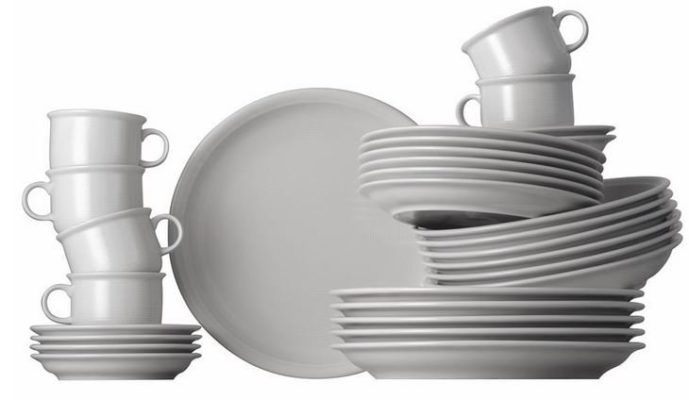
This screenshot has height=400, width=689. Find the location of `bowls`. bowls is located at coordinates (617, 201), (582, 224), (584, 234), (586, 248), (594, 259), (608, 265).